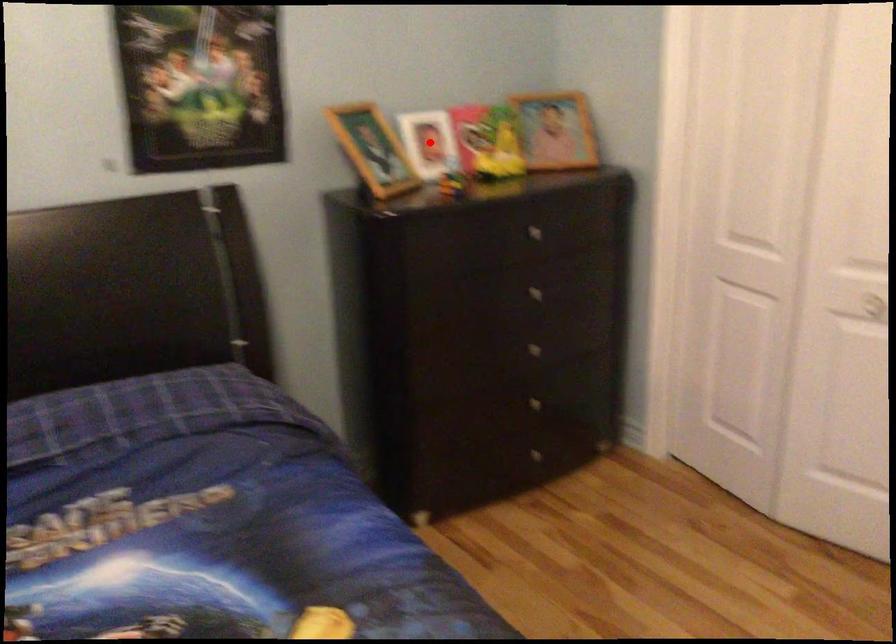
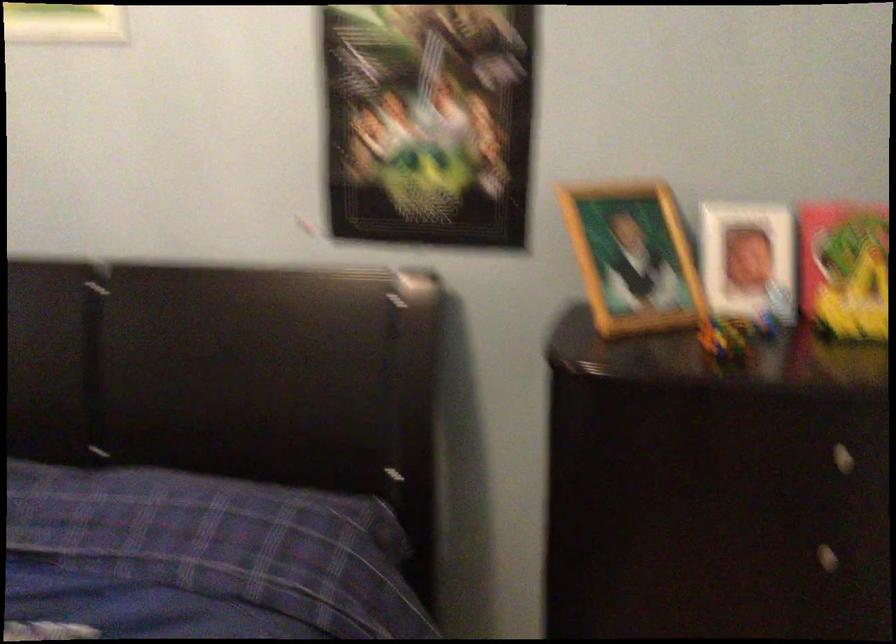
Where in the second image is the point corresponding to the highlighted location from the first image?

(748, 261)